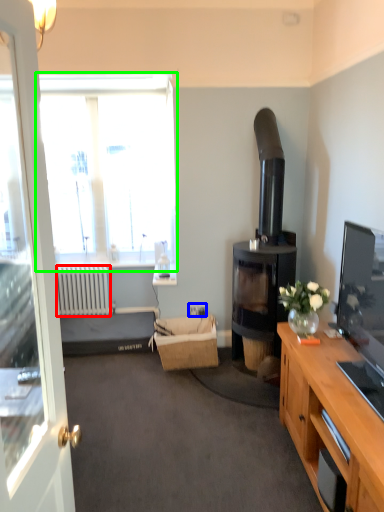
Question: Which object is positioned closest to radiator (highlighted by a red box)? Select from power outlet (highlighted by a blue box) and window (highlighted by a green box).

Choices:
 (A) power outlet
 (B) window

Answer: (B)